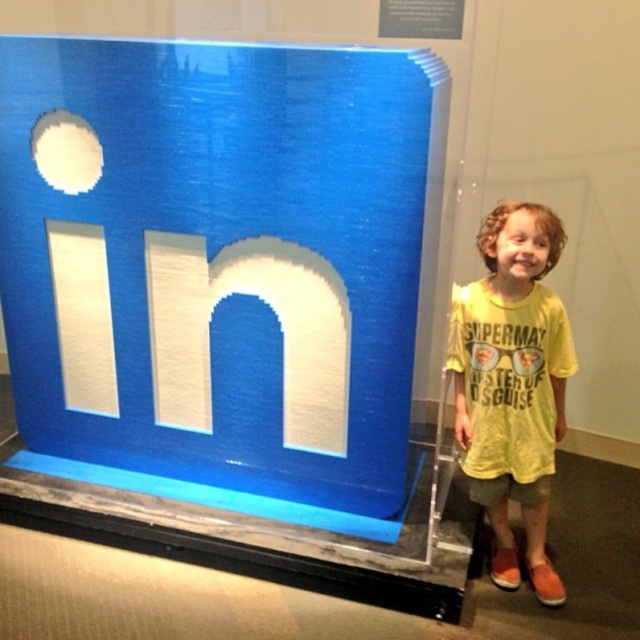
You are standing in front of the LinkedIn cube exhibit and want to take a photo of the white brushed metal letter n at center. Where should you position yourself to ensure the letter is in the center of your photo?

You should position yourself directly in front of the white brushed metal letter n at center, which is located at point coordinates (276, 321), to ensure it is centered in your photo.

You are a photographer trying to capture a photo of the white brushed metal letter n at center without the yellow cotton shirt at right appearing in the frame. Can you adjust your camera angle to achieve this? Explain your reasoning.

The yellow cotton shirt at right has a greater height compared to the white brushed metal letter n at center. By lowering the camera angle so that the shirt is out of the frame while keeping the letter n in view, you can avoid capturing the shirt.